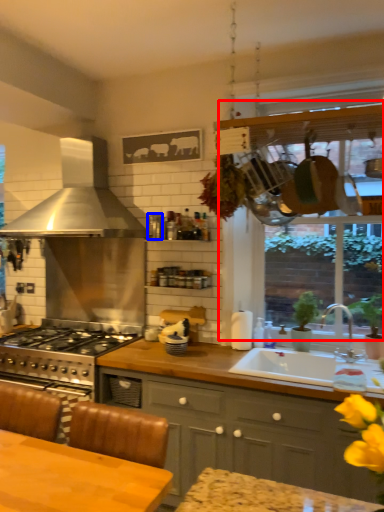
Question: Among these objects, which one is nearest to the camera, window frame (highlighted by a red box) or appliance (highlighted by a blue box)?

Choices:
 (A) window frame
 (B) appliance

Answer: (A)